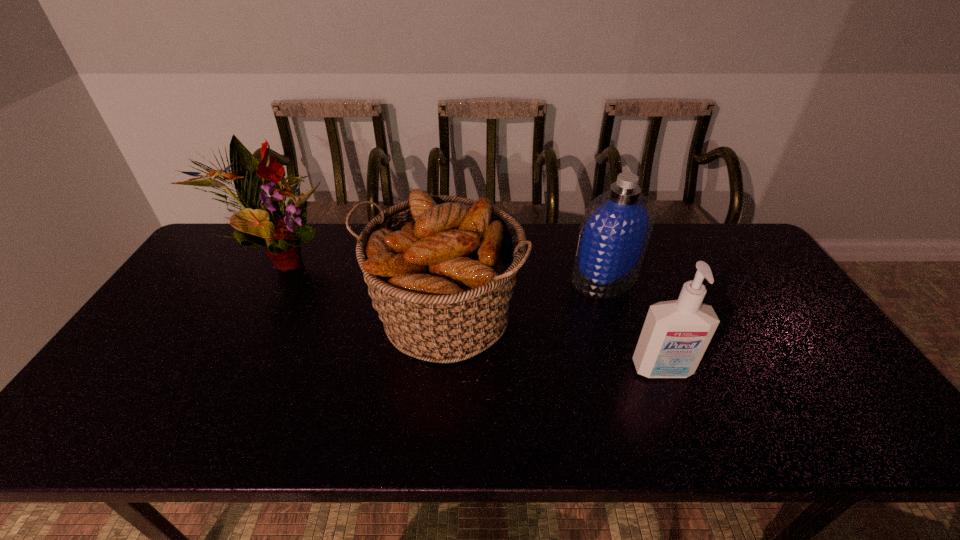
At what (x,y) coordinates should I click in order to perform the action: click on object present at the left edge. Please return your answer as a coordinate pair (x, y). Looking at the image, I should click on [265, 221].

The height and width of the screenshot is (540, 960). Identify the location of object located in the far left corner section of the desktop. (265, 221).

This screenshot has height=540, width=960. In the image, there is a desktop. In order to click on free space at the far edge in this screenshot , I will do `click(684, 260)`.

This screenshot has width=960, height=540. I want to click on free region at the near edge of the desktop, so click(649, 434).

You are a GUI agent. You are given a task and a screenshot of the screen. Output one action in this format:
    pyautogui.click(x=<x>, y=<y>)
    Task: Click on the vacant area at the left edge of the desktop
    The image size is (960, 540).
    Given the screenshot: What is the action you would take?
    pyautogui.click(x=169, y=364)

Image resolution: width=960 pixels, height=540 pixels. In the image, there is a desktop. Find the location of `vacant space at the right edge`. vacant space at the right edge is located at coordinates (847, 375).

The height and width of the screenshot is (540, 960). In the image, there is a desktop. In order to click on vacant region at the far left corner in this screenshot , I will do `click(205, 253)`.

The height and width of the screenshot is (540, 960). What are the coordinates of `free space at the far right corner of the desktop` in the screenshot? It's located at (752, 267).

Identify the location of empty space between the nearer cleansing agent and the basket. The image size is (960, 540). (553, 343).

The height and width of the screenshot is (540, 960). I want to click on vacant point located between the nearer cleansing agent and the basket, so click(x=553, y=343).